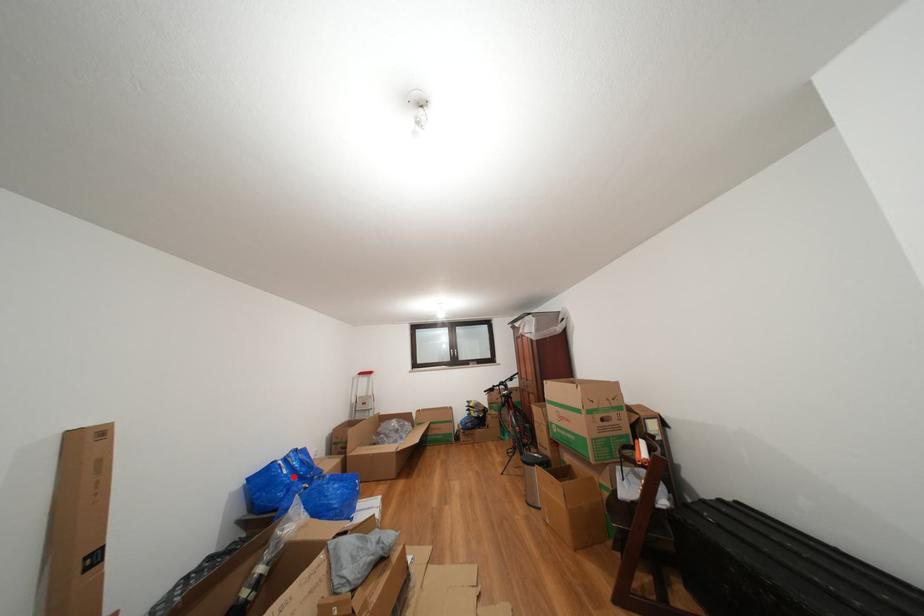
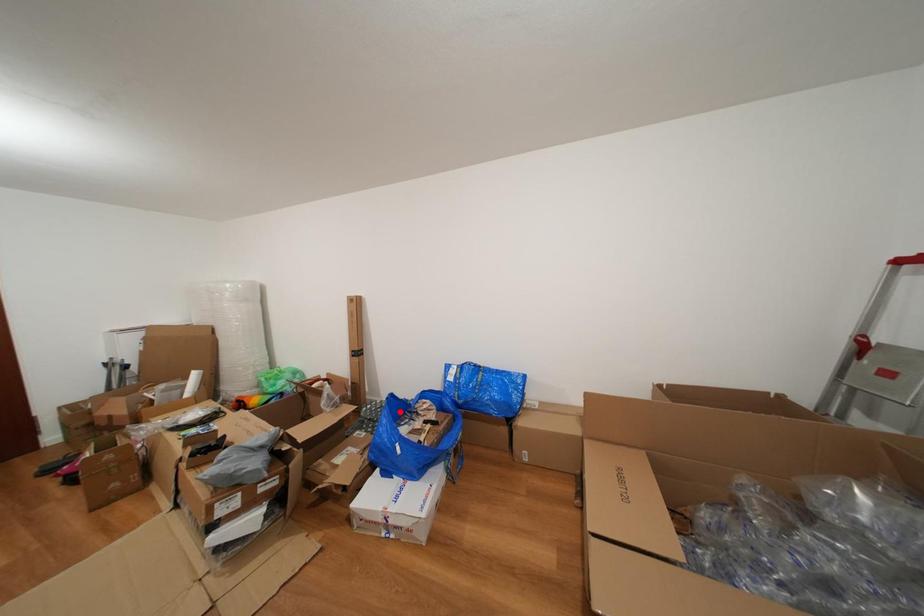
I am providing you with two images of the same scene from different viewpoints. A red point is marked on the first image and another point is marked on the second image. Does the point marked in image1 correspond to the same location as the one in image2?

No